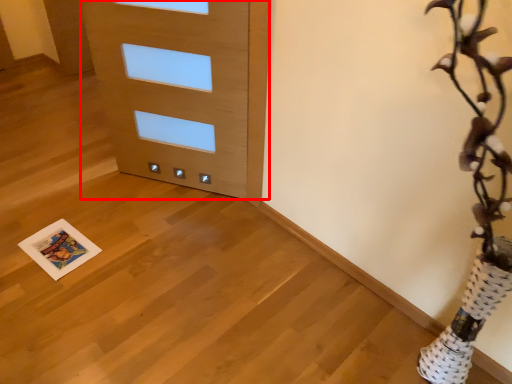
Question: From the image's perspective, what is the correct spatial relationship of door (annotated by the red box) in relation to print?

Choices:
 (A) above
 (B) below

Answer: (A)